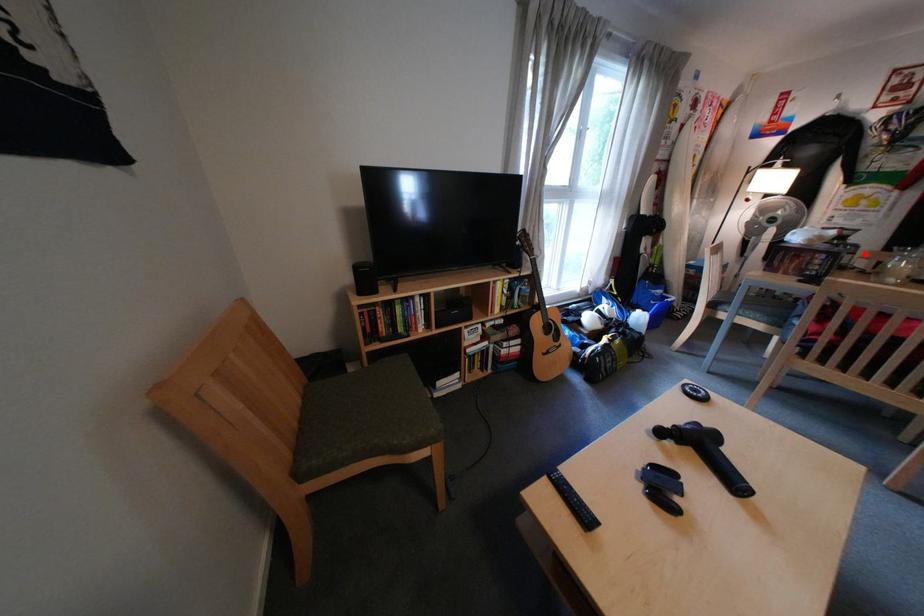
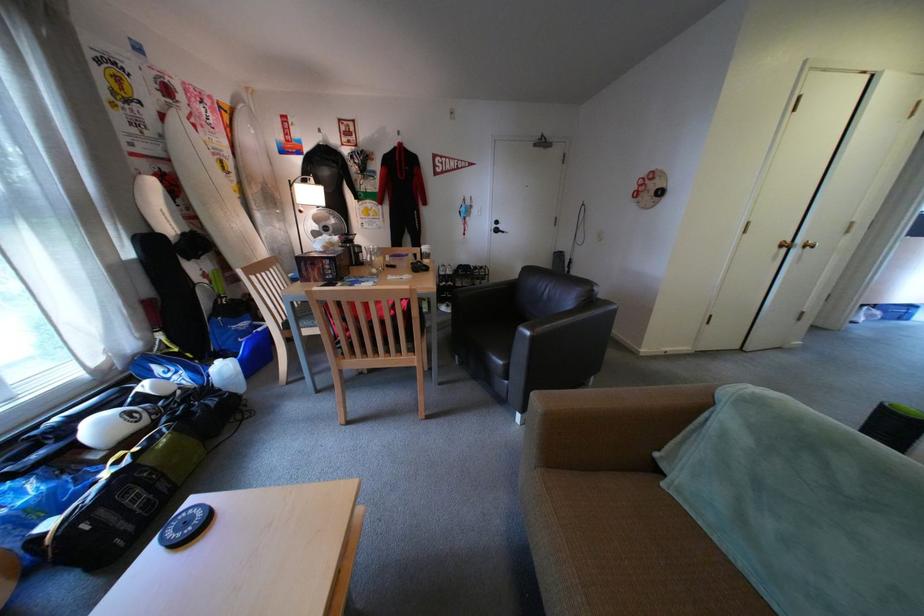
Find the pixel in the second image that matches the highlighted location in the first image.

(373, 253)